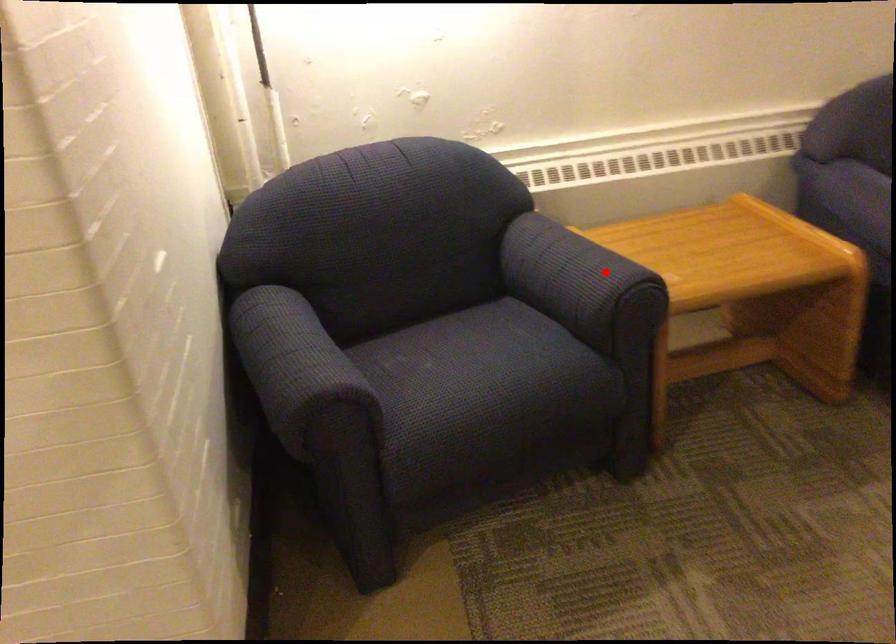
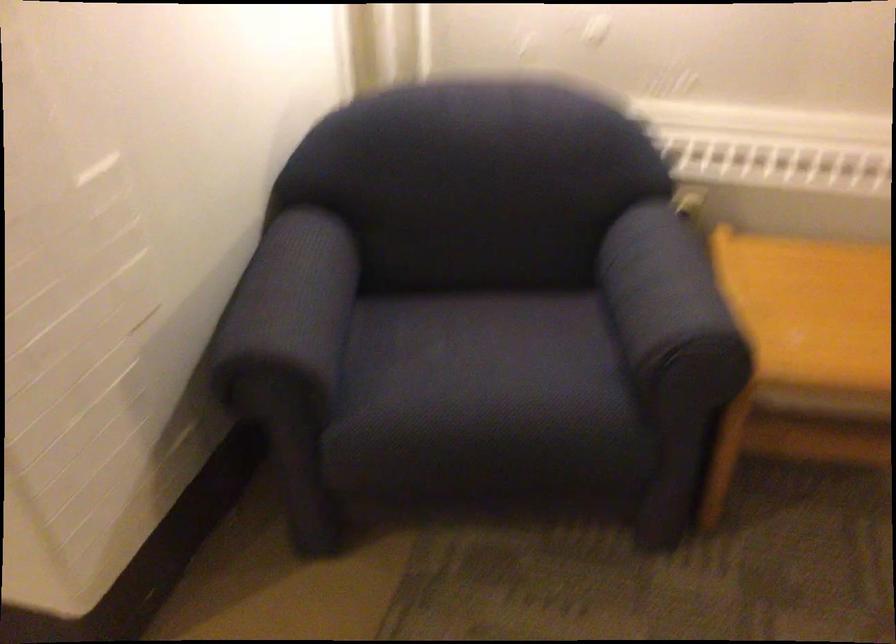
Find the pixel in the second image that matches the highlighted location in the first image.

(670, 307)